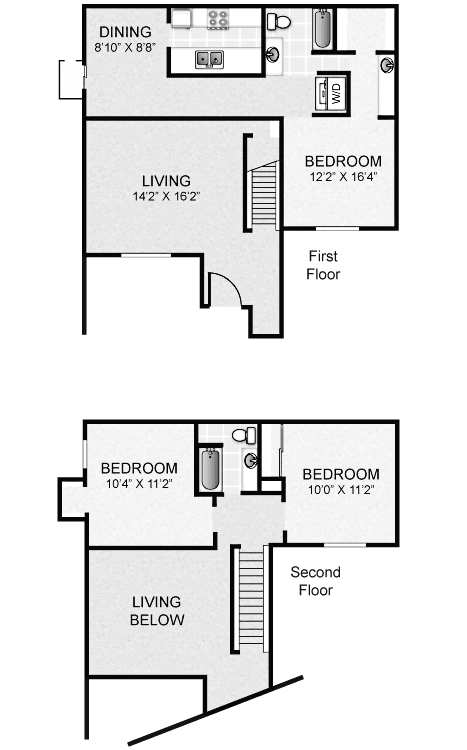
At what (x,y) coordinates should I click in order to perform the action: click on sliding doors. Please return your answer as a coordinate pair (x, y). Looking at the image, I should click on (85, 68), (84, 81), (282, 435), (280, 466).